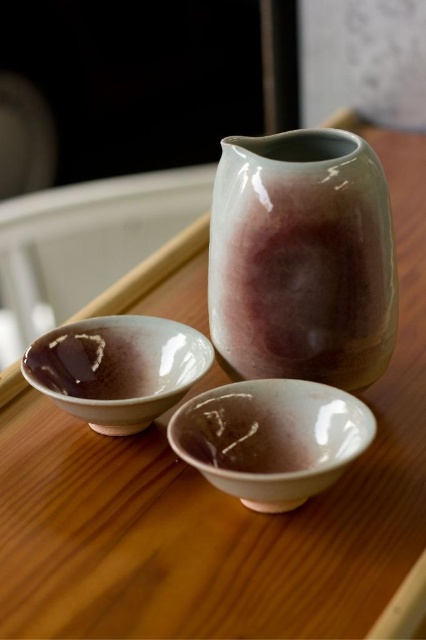
You are standing in front of the teaware arrangement and want to pick up the item closest to you. Which point should you reach for, point at (383, 250) or point at (94, 404)?

Point at (383, 250) is closer to you than point at (94, 404), so you should reach for point at (383, 250).

What is located at the coordinates point (302, 259)?

The matte ceramic vase at center is located at point (302, 259).

You are setting up a table for a tea ceremony and have a matte ceramic vase at center and a matte porcelain bowl at lower center. Which object has a greater width?

The matte ceramic vase at center has a greater width than the matte porcelain bowl at lower center.